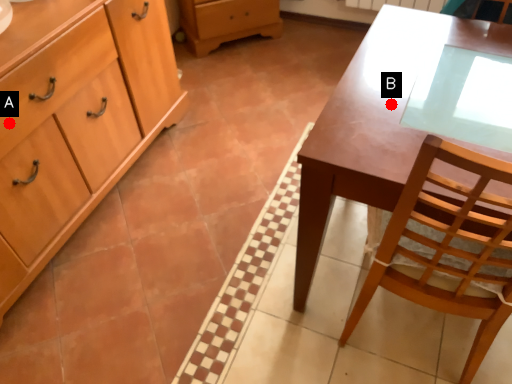
Question: Two points are circled on the image, labeled by A and B beside each circle. Which point appears closest to the camera in this image?

Choices:
 (A) A is closer
 (B) B is closer

Answer: (B)